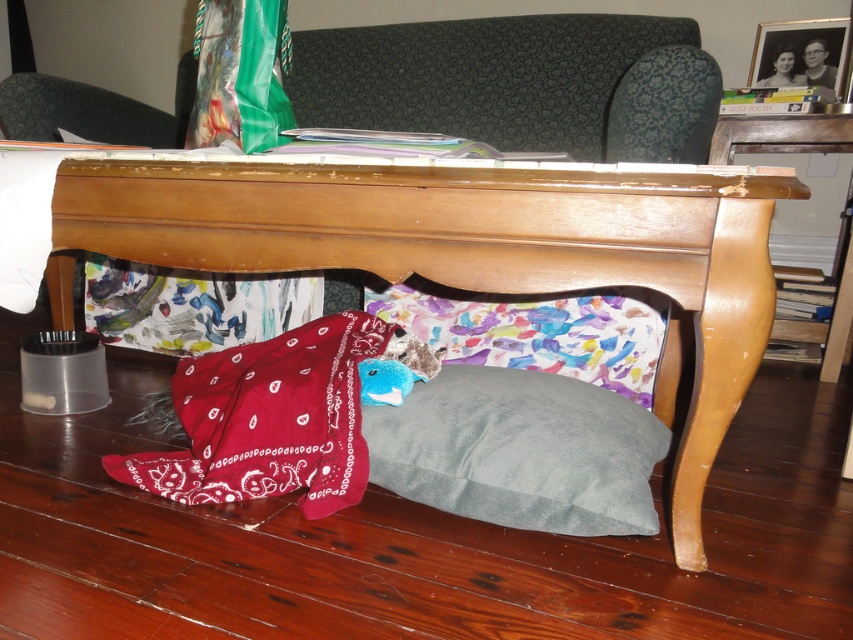
You are organizing the living room and need to move the gray velvety pillow at lower center and the glossy wood side table at lower right. Which object should you move first to access the items underneath the coffee table?

The gray velvety pillow at lower center should be moved first because it is in front of the glossy wood side table at lower right, so moving it first will allow access to the items underneath.

You are trying to place a small statue that requires a flat surface. Given the scene, which object between the watercolor fabric pillow at under table and the glossy wood side table at lower right would be more suitable for placing the statue?

The glossy wood side table at lower right is more suitable for placing the statue because the watercolor fabric pillow at under table has a greater height, making it less stable for a flat surface.

You are trying to place a large decorative item on the wooden table at lower center and the glossy wood side table at lower right. Which surface can accommodate the item if it requires more width?

The wooden table at lower center can accommodate the item since it might be wider than the glossy wood side table at lower right according to the description.